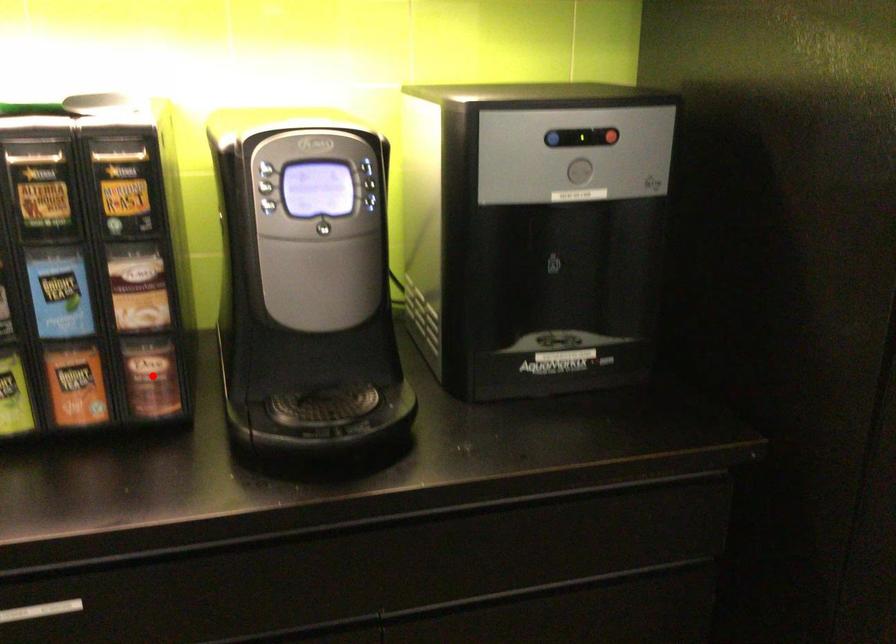
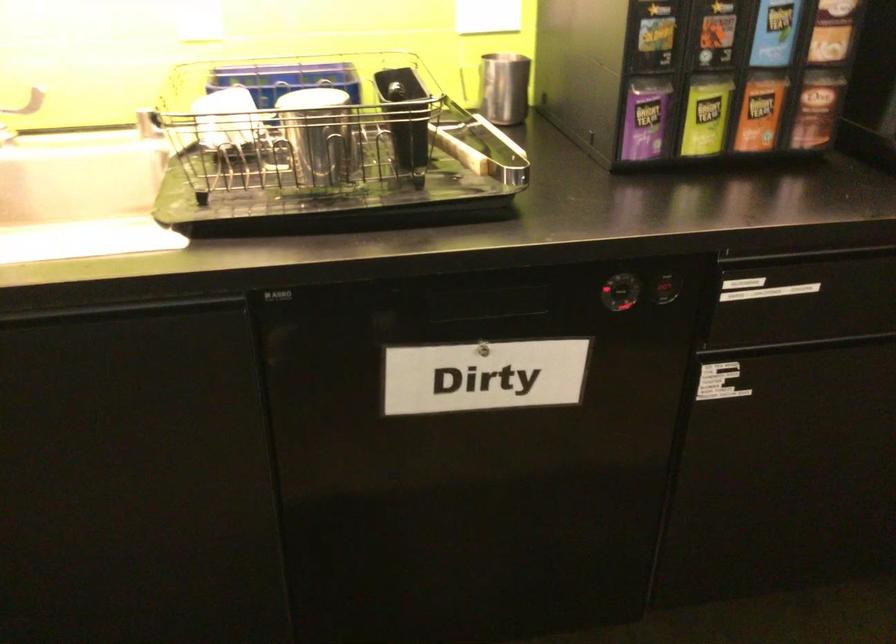
Find the pixel in the second image that matches the highlighted location in the first image.

(816, 109)